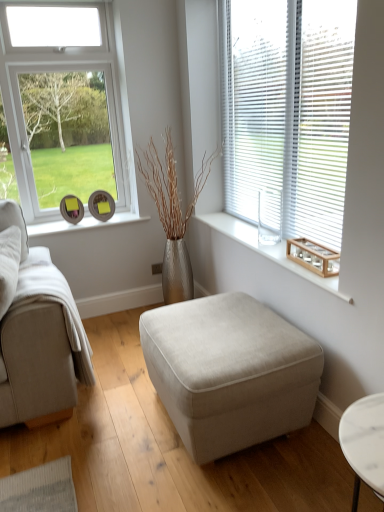
Question: From the image's perspective, is beige fabric ottoman at center located beneath white plastic blinds at upper right?

Choices:
 (A) no
 (B) yes

Answer: (B)

Question: Is beige fabric ottoman at center positioned far away from white plastic blinds at upper right?

Choices:
 (A) yes
 (B) no

Answer: (B)

Question: From a real-world perspective, is beige fabric ottoman at center on top of white plastic blinds at upper right?

Choices:
 (A) no
 (B) yes

Answer: (A)

Question: Does beige fabric ottoman at center have a greater height compared to white plastic blinds at upper right?

Choices:
 (A) yes
 (B) no

Answer: (B)

Question: Considering the relative sizes of beige fabric ottoman at center and white plastic blinds at upper right in the image provided, is beige fabric ottoman at center thinner than white plastic blinds at upper right?

Choices:
 (A) yes
 (B) no

Answer: (B)

Question: From the image's perspective, is beige fabric ottoman at center located above white plastic blinds at upper right?

Choices:
 (A) yes
 (B) no

Answer: (B)

Question: Is wooden tray at right positioned behind white plastic blinds at upper right?

Choices:
 (A) yes
 (B) no

Answer: (A)

Question: Is wooden tray at right located outside white plastic blinds at upper right?

Choices:
 (A) no
 (B) yes

Answer: (B)

Question: Is white plastic blinds at upper right located within wooden tray at right?

Choices:
 (A) no
 (B) yes

Answer: (A)

Question: Is wooden tray at right oriented towards white plastic blinds at upper right?

Choices:
 (A) yes
 (B) no

Answer: (B)

Question: From the image's perspective, is wooden tray at right on white plastic blinds at upper right?

Choices:
 (A) yes
 (B) no

Answer: (B)

Question: Is wooden tray at right thinner than white plastic blinds at upper right?

Choices:
 (A) yes
 (B) no

Answer: (B)

Question: Is white plastic blinds at upper right bigger than beige fabric ottoman at center?

Choices:
 (A) yes
 (B) no

Answer: (B)